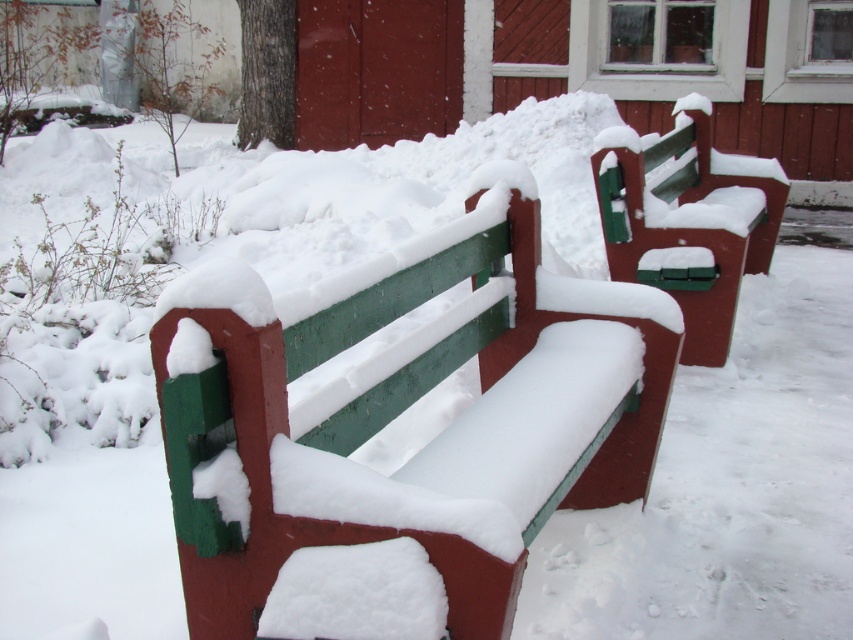
The image size is (853, 640). I want to click on green painted wood bench at center, so click(x=392, y=419).

Does green painted wood bench at center appear under green matte bench at center?

Yes.

Which is in front, point (526, 380) or point (694, 202)?

Positioned in front is point (526, 380).

Find the location of a particular element. The image size is (853, 640). green painted wood bench at center is located at coordinates (392, 419).